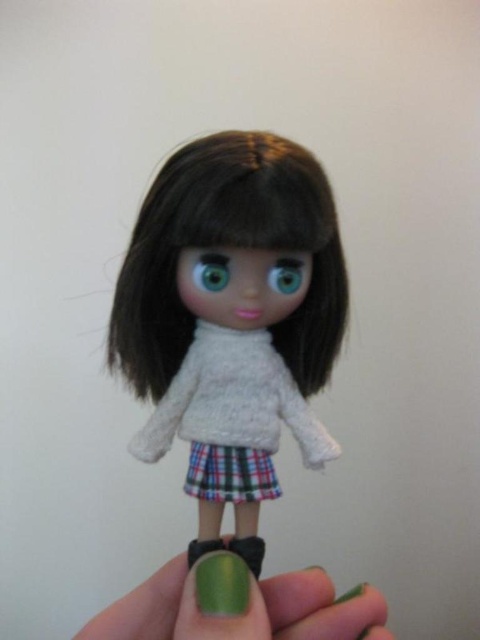
Does dark brown silky hair at center have a greater width compared to green metallic nail polish at lower center?

No.

Who is shorter, dark brown silky hair at center or green metallic nail polish at lower center?

With less height is green metallic nail polish at lower center.

Between point (148, 252) and point (310, 632), which one is positioned in front?

Point (310, 632) is in front.

You are a GUI agent. You are given a task and a screenshot of the screen. Output one action in this format:
    pyautogui.click(x=<x>, y=<y>)
    Task: Click on the dark brown silky hair at center
    Image resolution: width=480 pixels, height=640 pixels.
    Given the screenshot: What is the action you would take?
    pyautogui.click(x=230, y=244)

Between point (213, 410) and point (227, 262), which one is positioned in front?

Point (227, 262) is in front.

Can you confirm if white knitted sweater at center is positioned to the right of green matte eye at center?

Indeed, white knitted sweater at center is positioned on the right side of green matte eye at center.

Find the location of a particular element. white knitted sweater at center is located at coordinates [232, 417].

Locate an element on the screen. white knitted sweater at center is located at coordinates (232, 417).

Can you confirm if dark brown silky hair at center is positioned below blue glossy eye at center?

Yes, dark brown silky hair at center is below blue glossy eye at center.

In the scene shown: Can you confirm if dark brown silky hair at center is thinner than blue glossy eye at center?

Incorrect, dark brown silky hair at center's width is not less than blue glossy eye at center's.

This screenshot has height=640, width=480. I want to click on dark brown silky hair at center, so click(x=230, y=244).

The height and width of the screenshot is (640, 480). In order to click on dark brown silky hair at center in this screenshot , I will do pyautogui.click(x=230, y=244).